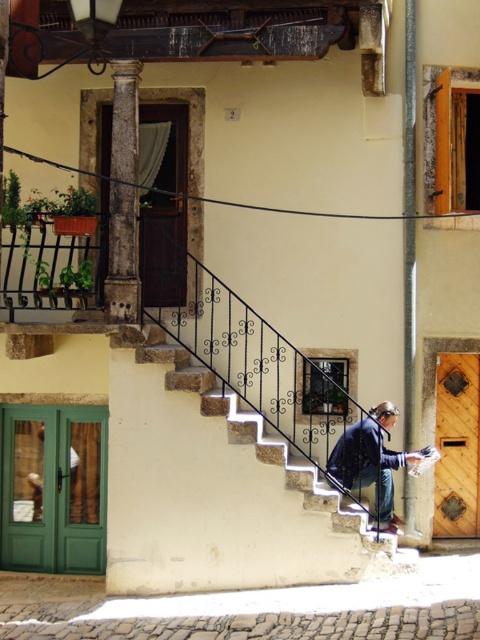
What do you see at coordinates (214, 486) in the screenshot? The height and width of the screenshot is (640, 480). I see `stone textured stairs at center` at bounding box center [214, 486].

Can you confirm if stone textured stairs at center is taller than blue denim jacket at center?

Indeed, stone textured stairs at center has a greater height compared to blue denim jacket at center.

Between point (289, 572) and point (377, 422), which one is positioned behind?

Positioned behind is point (377, 422).

Where is `stone textured stairs at center`? Image resolution: width=480 pixels, height=640 pixels. stone textured stairs at center is located at coordinates (214, 486).

The width and height of the screenshot is (480, 640). Find the location of `blue denim jacket at center`. blue denim jacket at center is located at coordinates (371, 461).

Is point (344, 449) behind point (69, 452)?

No, (344, 449) is in front of (69, 452).

The width and height of the screenshot is (480, 640). I want to click on blue denim jacket at center, so click(371, 461).

Is stone textured stairs at center smaller than rustic stone column at left?

Actually, stone textured stairs at center might be larger than rustic stone column at left.

Does point (214, 545) come farther from viewer compared to point (110, 209)?

No, it is in front of (110, 209).

Between point (149, 589) and point (128, 182), which one is positioned behind?

The point (149, 589) is behind.

The height and width of the screenshot is (640, 480). What are the coordinates of `stone textured stairs at center` in the screenshot? It's located at (214, 486).